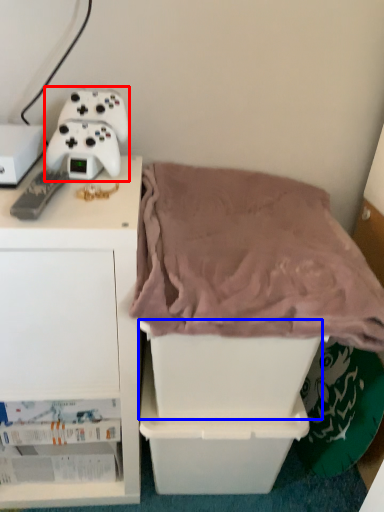
Question: Among these objects, which one is nearest to the camera, game controller (highlighted by a red box) or storage box (highlighted by a blue box)?

Choices:
 (A) game controller
 (B) storage box

Answer: (B)